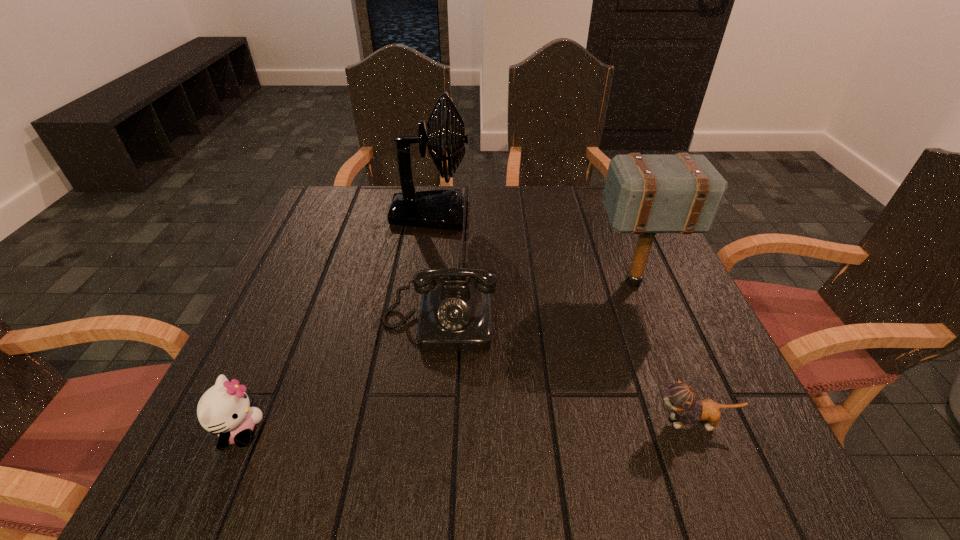
In the image, there is a desktop. Where is `vacant space at the far edge`? The height and width of the screenshot is (540, 960). vacant space at the far edge is located at coordinates (550, 201).

Image resolution: width=960 pixels, height=540 pixels. Find the location of `free space at the near edge`. free space at the near edge is located at coordinates (367, 478).

Locate an element on the screen. blank space at the left edge is located at coordinates (315, 377).

The image size is (960, 540). I want to click on free space at the right edge of the desktop, so click(615, 246).

Identify the location of vacant space at the far left corner of the desktop. The image size is (960, 540). (310, 215).

You are a GUI agent. You are given a task and a screenshot of the screen. Output one action in this format:
    pyautogui.click(x=<x>, y=<y>)
    Task: Click on the free region at the near left corner of the desktop
    The width and height of the screenshot is (960, 540).
    Given the screenshot: What is the action you would take?
    pyautogui.click(x=182, y=477)

Locate an element on the screen. This screenshot has width=960, height=540. free region at the far right corner of the desktop is located at coordinates (609, 231).

This screenshot has width=960, height=540. What are the coordinates of `vacant point located between the mallet and the telephone` in the screenshot? It's located at (537, 302).

The width and height of the screenshot is (960, 540). In order to click on empty location between the farthest object and the right kitten in this screenshot , I will do `click(562, 318)`.

Identify the location of free spot between the right kitten and the fan. This screenshot has width=960, height=540. pos(562,318).